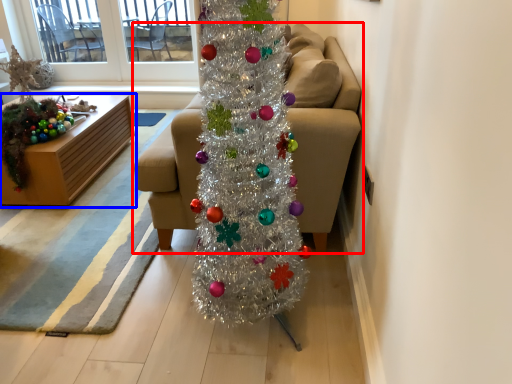
Question: Among these objects, which one is nearest to the camera, studio couch (highlighted by a red box) or furniture (highlighted by a blue box)?

Choices:
 (A) studio couch
 (B) furniture

Answer: (A)